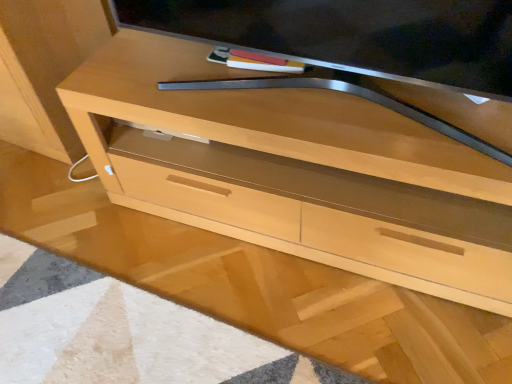
The height and width of the screenshot is (384, 512). Find the location of `empty space that is ontop of light wood chest of drawers at center (from a real-world perspective)`. empty space that is ontop of light wood chest of drawers at center (from a real-world perspective) is located at coordinates (285, 90).